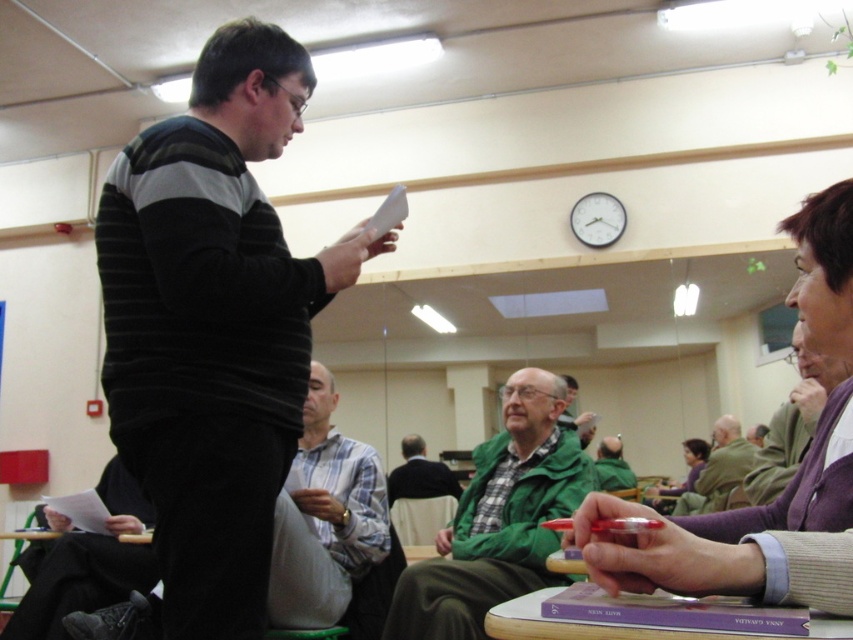
You are an attendee at this meeting and want to greet the person wearing the green woolen sweater at center. Which direction should you move to find them relative to the green textured jacket at center?

The green textured jacket at center is to the right of the green woolen sweater at center, so to find the green woolen sweater at center, you should move to the left from the green textured jacket at center.

You are organizing a group activity and need to determine seating arrangements. You have a limited space and want to ensure everyone has enough room. Based on the image, which of the two people at the center, the green matte jacket at center or the white plaid shirt at center, requires more space due to their clothing size?

The green matte jacket at center might be wider than white plaid shirt at center, so it requires more space due to its size.

You are standing in the room and want to hand a document to the person wearing the green matte jacket at center. According to the spatial coordinates provided, where should you walk to find them?

The green matte jacket at center is located at point (498, 518), so you should walk to that coordinate to find them.